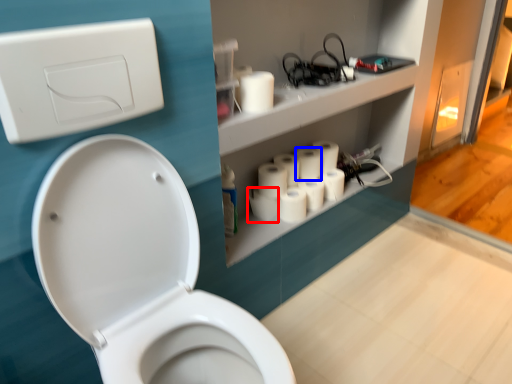
Question: Which object appears farthest to the camera in this image, toilet paper (highlighted by a red box) or toilet paper (highlighted by a blue box)?

Choices:
 (A) toilet paper
 (B) toilet paper

Answer: (B)